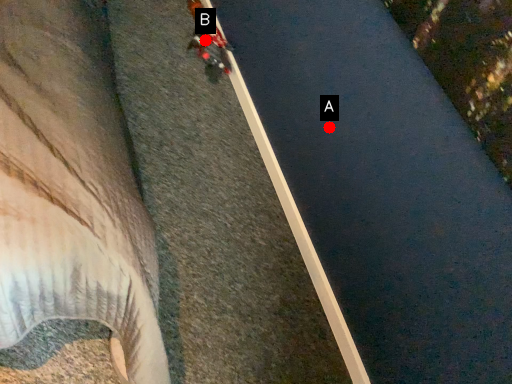
Question: Two points are circled on the image, labeled by A and B beside each circle. Among these points, which one is farthest from the camera?

Choices:
 (A) A is further
 (B) B is further

Answer: (B)